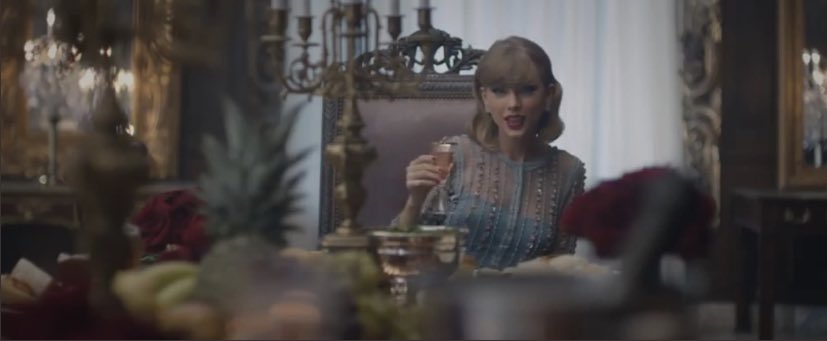
The height and width of the screenshot is (341, 827). I want to click on picture frame, so click(x=790, y=97).